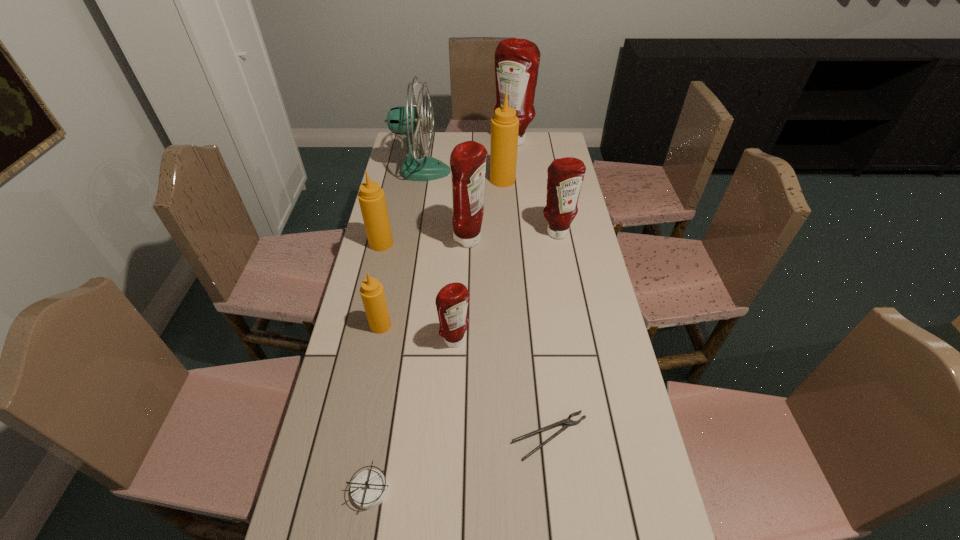
Where is `vacant space located 0.330m on the back of the nearest red condiment`? The width and height of the screenshot is (960, 540). vacant space located 0.330m on the back of the nearest red condiment is located at coordinates (460, 255).

At what (x,y) coordinates should I click in order to perform the action: click on free space located 0.090m on the back of the smallest tan condiment. Please return your answer as a coordinate pair (x, y). This screenshot has height=540, width=960. Looking at the image, I should click on (387, 295).

I want to click on free space located on the back of the compass, so click(x=382, y=420).

The image size is (960, 540). In order to click on free space located on the back of the second nearest object in this screenshot , I will do `click(534, 296)`.

The width and height of the screenshot is (960, 540). In order to click on condiment located in the far edge section of the desktop in this screenshot , I will do `click(517, 61)`.

In order to click on fan situated at the far edge in this screenshot , I will do `click(407, 120)`.

You are a GUI agent. You are given a task and a screenshot of the screen. Output one action in this format:
    pyautogui.click(x=<x>, y=<y>)
    Task: Click on the fan at the left edge
    
    Given the screenshot: What is the action you would take?
    pyautogui.click(x=407, y=120)

Find the location of a particular element. compass present at the left edge is located at coordinates click(368, 490).

Image resolution: width=960 pixels, height=540 pixels. What are the coordinates of `tongs that is at the right edge` in the screenshot? It's located at (567, 422).

I want to click on object present at the far left corner, so click(407, 120).